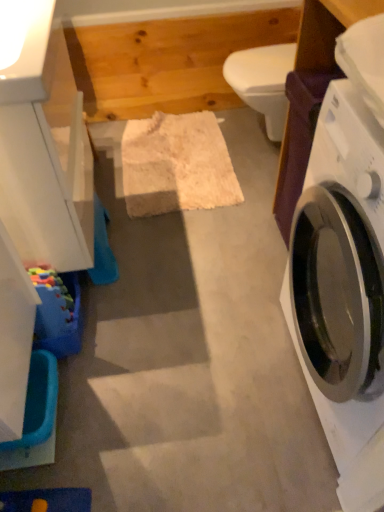
The height and width of the screenshot is (512, 384). Find the location of `empty space that is ontop of white glossy toilet bowl at center (from a real-world perspective)`. empty space that is ontop of white glossy toilet bowl at center (from a real-world perspective) is located at coordinates (274, 61).